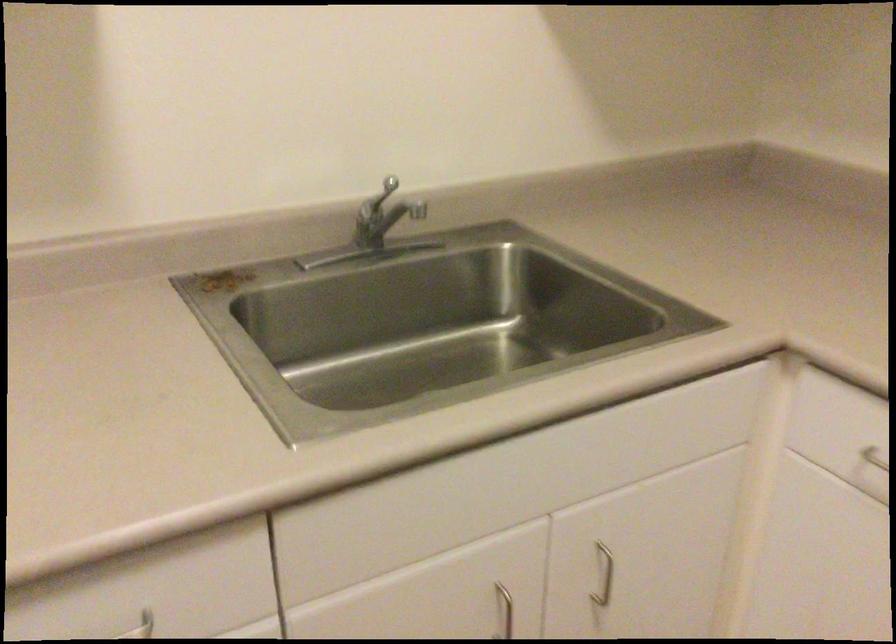
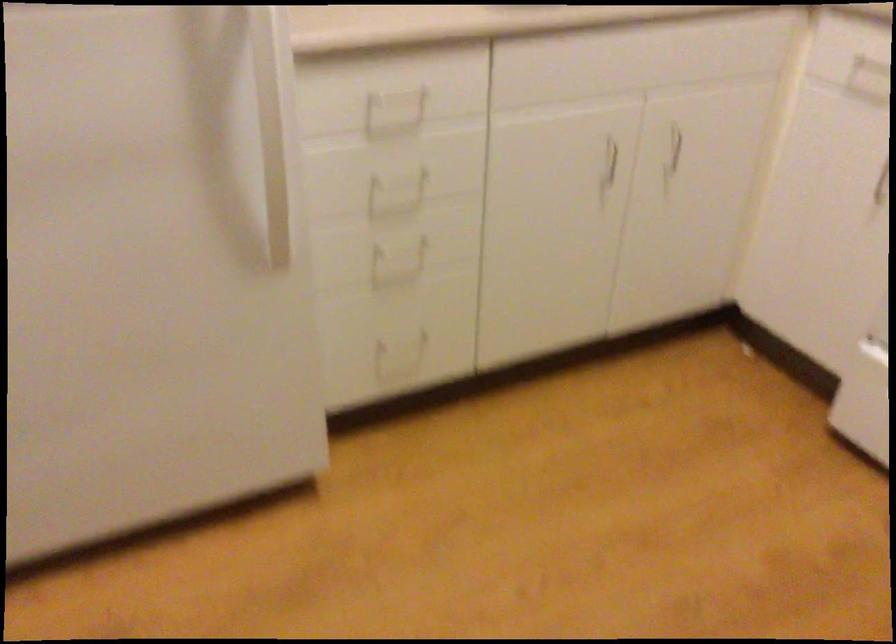
Question: The images are taken continuously from a first-person perspective. In which direction is your viewpoint rotating?

Choices:
 (A) Left
 (B) Right
 (C) Up
 (D) Down

Answer: (D)